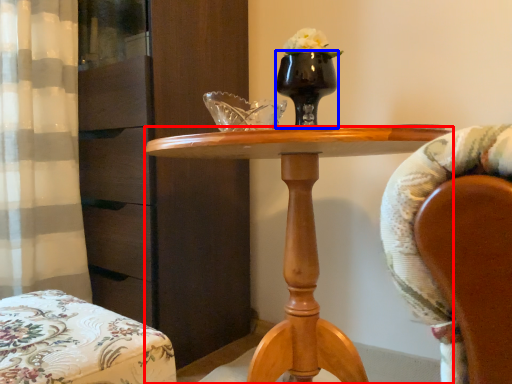
Question: Among these objects, which one is nearest to the camera, desk (highlighted by a red box) or vase (highlighted by a blue box)?

Choices:
 (A) desk
 (B) vase

Answer: (A)